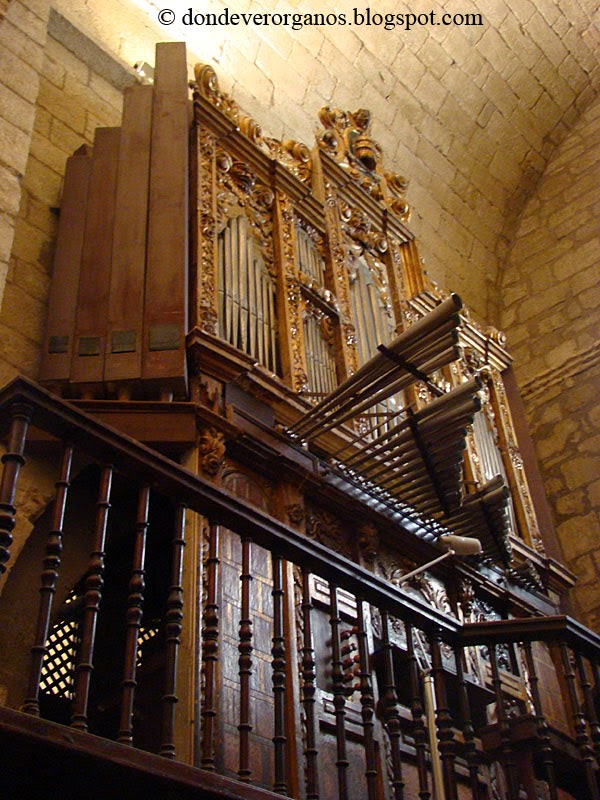
Identify the location of wooden boards. (139, 268).